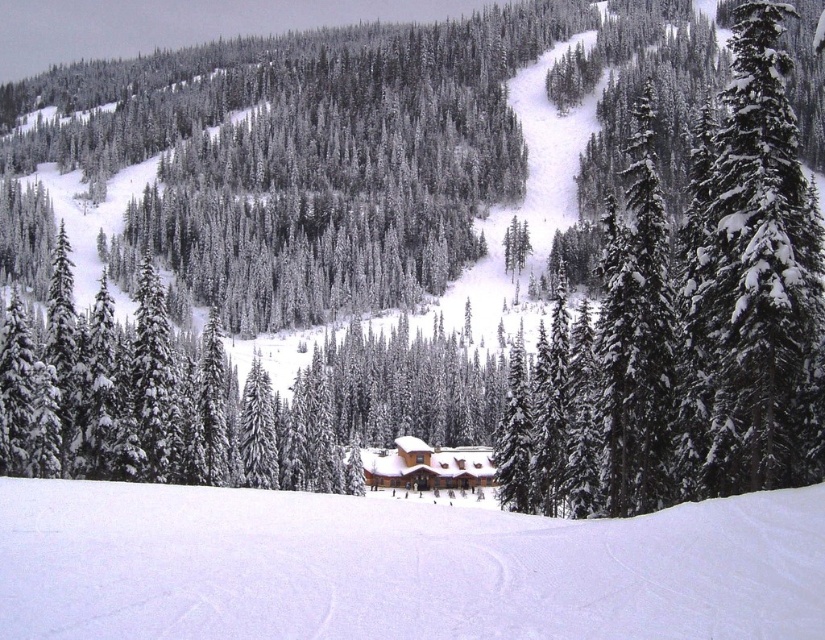
Looking at this image, you are a photographer standing at the base of the mountain, aiming to capture the green textured pine tree at upper center in your shot. Given that your camera has a maximum zoom range of 25 meters, will you be able to clearly focus on the tree without moving closer?

The green textured pine tree at upper center is 28.25 meters away from the camera, which exceeds the camera maximum zoom range of 25 meters. Therefore, the photographer cannot clearly focus on the tree without moving closer.